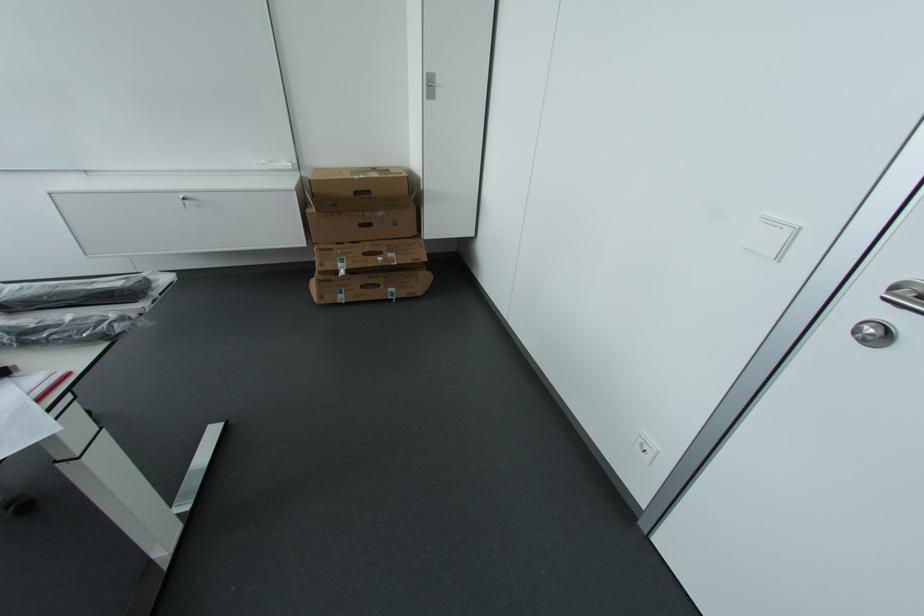
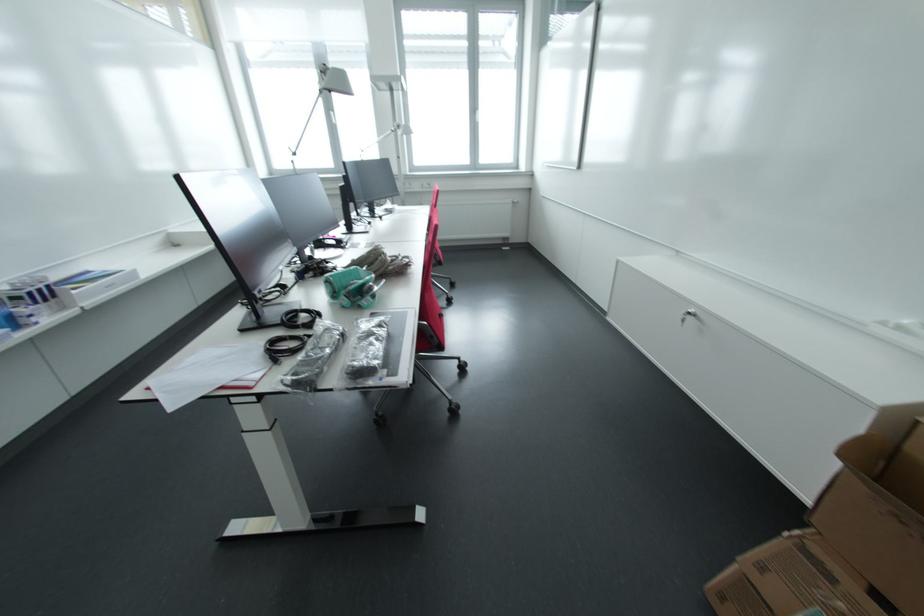
Locate, in the second image, the point that corresponds to point (187, 200) in the first image.

(694, 315)